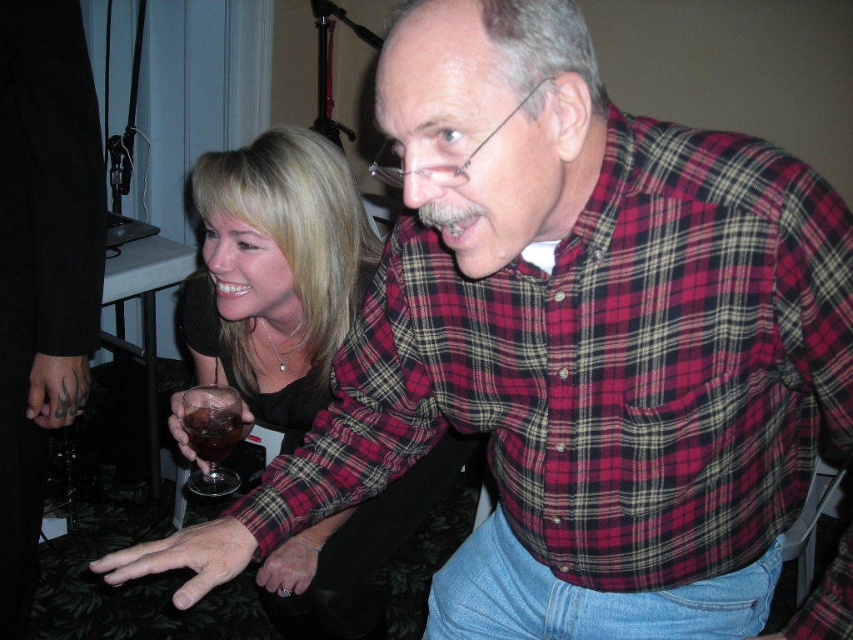
You are a photographer at a social event. You need to capture a photo of the matte black dress at center and the translucent glass drink at center. Which object should you focus on first if you want to ensure both are in frame without moving the camera?

You should focus on the matte black dress at center first because it is wider than the translucent glass drink at center, ensuring it fits within the frame before adjusting for the smaller object.

You are organizing a photoshoot and need to position a model exactly at the center of the image. The matte black dress at center is currently at coordinates point 0.428, 0.324. Is the dress already centered, or does it need adjustment?

The matte black dress at center is located at point (276, 273). Since the center of the image is typically at coordinates (426, 320), the dress is slightly off to the left and bottom. Adjustments are needed to move it closer to the center coordinates.